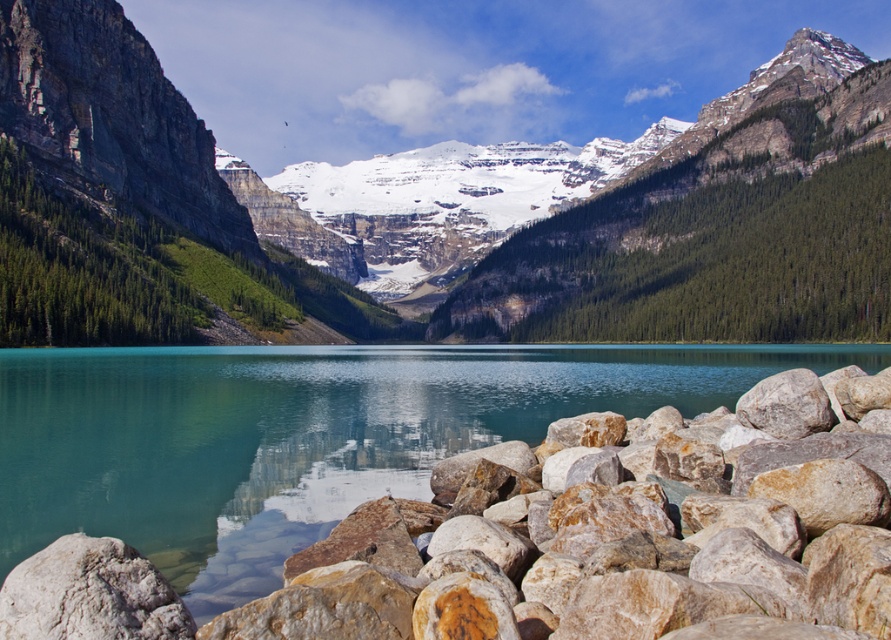
Question: Is snowy rocky mountain at center positioned in front of rusty rock at lower right?

Choices:
 (A) no
 (B) yes

Answer: (A)

Question: Among these points, which one is farthest from the camera?

Choices:
 (A) (47, 356)
 (B) (161, 109)

Answer: (B)

Question: Among these objects, which one is farthest from the camera?

Choices:
 (A) rusty rock at lower right
 (B) snowy rocky mountain at center

Answer: (B)

Question: Which object is closer to the camera taking this photo?

Choices:
 (A) rusty rock at lower right
 (B) snowy rocky mountain at center

Answer: (A)

Question: Is snowy rocky mountain at center wider than rusty rock at lower right?

Choices:
 (A) no
 (B) yes

Answer: (B)

Question: Is snowy rocky mountain at center bigger than rusty rock at lower right?

Choices:
 (A) no
 (B) yes

Answer: (B)